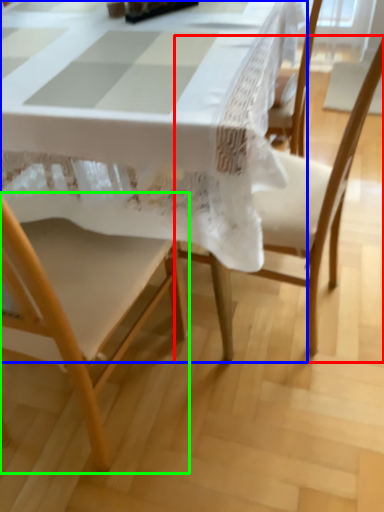
Question: Based on their relative distances, which object is nearer to chair (highlighted by a red box)? Choose from table (highlighted by a blue box) and chair (highlighted by a green box).

Choices:
 (A) table
 (B) chair

Answer: (B)